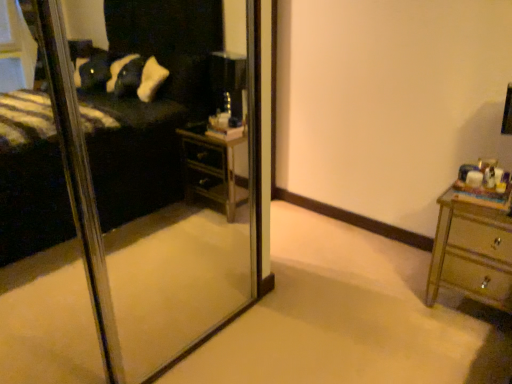
From the picture: What is the approximate height of wooden chest of drawers at right?

wooden chest of drawers at right is 21.91 inches tall.

You are a GUI agent. You are given a task and a screenshot of the screen. Output one action in this format:
    pyautogui.click(x=<x>, y=<y>)
    Task: Click on the wooden chest of drawers at right
    The width and height of the screenshot is (512, 384).
    Given the screenshot: What is the action you would take?
    pyautogui.click(x=471, y=253)

Measure the distance between wooden chest of drawers at right and camera.

1.61 meters.

The width and height of the screenshot is (512, 384). What do you see at coordinates (471, 253) in the screenshot?
I see `wooden chest of drawers at right` at bounding box center [471, 253].

In order to face wooden chest of drawers at right, should I rotate leftwards or rightwards?

Turn right approximately 28.723 degrees to face it.

Find the location of a particular element. This screenshot has width=512, height=384. wooden chest of drawers at right is located at coordinates (471, 253).